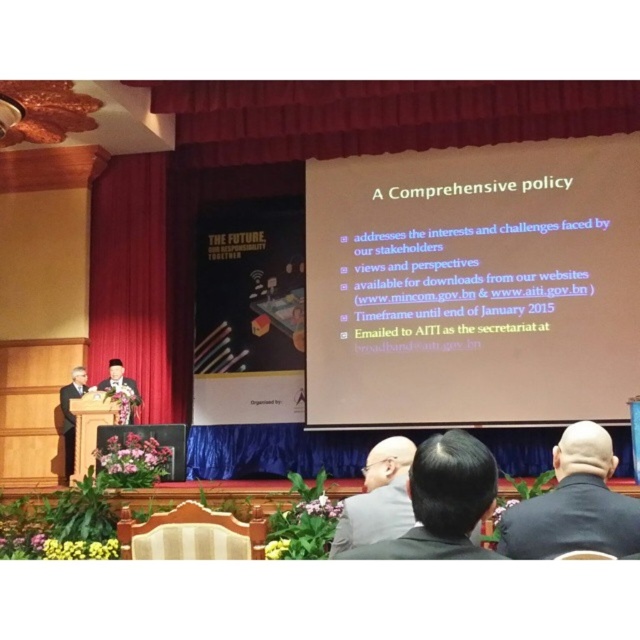
Question: Can you confirm if red velvet curtain at left is positioned to the right of blue fabric curtain at lower center?

Choices:
 (A) yes
 (B) no

Answer: (B)

Question: Which of the following is the farthest from the observer?

Choices:
 (A) blue fabric curtain at lower center
 (B) matte black suit at left
 (C) black fabric jacket at lower right
 (D) black suit at center

Answer: (A)

Question: Where is red velvet curtain at left located in relation to black suit at center in the image?

Choices:
 (A) right
 (B) left

Answer: (B)

Question: Among these points, which one is farthest from the camera?

Choices:
 (A) (380, 436)
 (B) (74, 376)

Answer: (A)

Question: Based on their relative distances, which object is farther from the red velvet curtain at left?

Choices:
 (A) dark gray suit at center
 (B) black suit at center

Answer: (B)

Question: Can you confirm if black suit at center is wider than dark gray suit at center?

Choices:
 (A) yes
 (B) no

Answer: (A)